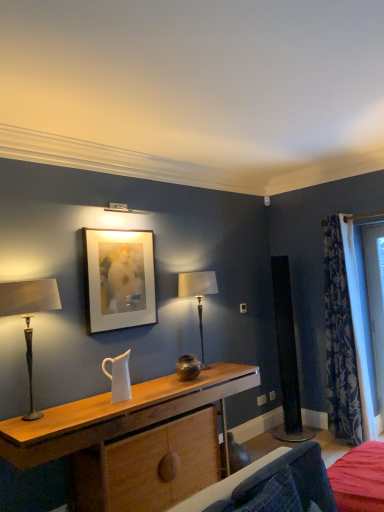
Question: Is matte white picture frame at upper center at the back of wooden desk at center?

Choices:
 (A) yes
 (B) no

Answer: (B)

Question: Is wooden desk at center shorter than matte white picture frame at upper center?

Choices:
 (A) yes
 (B) no

Answer: (A)

Question: Can you confirm if wooden desk at center is positioned to the right of matte white picture frame at upper center?

Choices:
 (A) no
 (B) yes

Answer: (B)

Question: Can you confirm if wooden desk at center is wider than matte white picture frame at upper center?

Choices:
 (A) yes
 (B) no

Answer: (A)

Question: Is wooden desk at center not close to matte white picture frame at upper center?

Choices:
 (A) yes
 (B) no

Answer: (B)

Question: From the image's perspective, is wooden desk at center over matte white picture frame at upper center?

Choices:
 (A) yes
 (B) no

Answer: (B)

Question: Is matte bronze table lamp at left, which is counted as the second table lamp, starting from the back, aimed at wooden desk at center?

Choices:
 (A) no
 (B) yes

Answer: (A)

Question: Is matte bronze table lamp at left, arranged as the first table lamp when viewed from the front, placed right next to wooden desk at center?

Choices:
 (A) no
 (B) yes

Answer: (A)

Question: Is matte bronze table lamp at left, which is the 2th table lamp from right to left, to the left of wooden desk at center from the viewer's perspective?

Choices:
 (A) no
 (B) yes

Answer: (B)

Question: Is matte bronze table lamp at left, arranged as the first table lamp when viewed from the front, shorter than wooden desk at center?

Choices:
 (A) yes
 (B) no

Answer: (B)

Question: From a real-world perspective, is matte bronze table lamp at left, arranged as the first table lamp when viewed from the front, on top of wooden desk at center?

Choices:
 (A) no
 (B) yes

Answer: (B)

Question: From the image's perspective, is matte bronze table lamp at left, which is counted as the second table lamp, starting from the back, above wooden desk at center?

Choices:
 (A) no
 (B) yes

Answer: (B)

Question: Considering the relative positions of matte bronze table lamp at center, the 1th table lamp positioned from the right, and matte white picture frame at upper center in the image provided, is matte bronze table lamp at center, the 1th table lamp positioned from the right, to the left of matte white picture frame at upper center from the viewer's perspective?

Choices:
 (A) yes
 (B) no

Answer: (B)